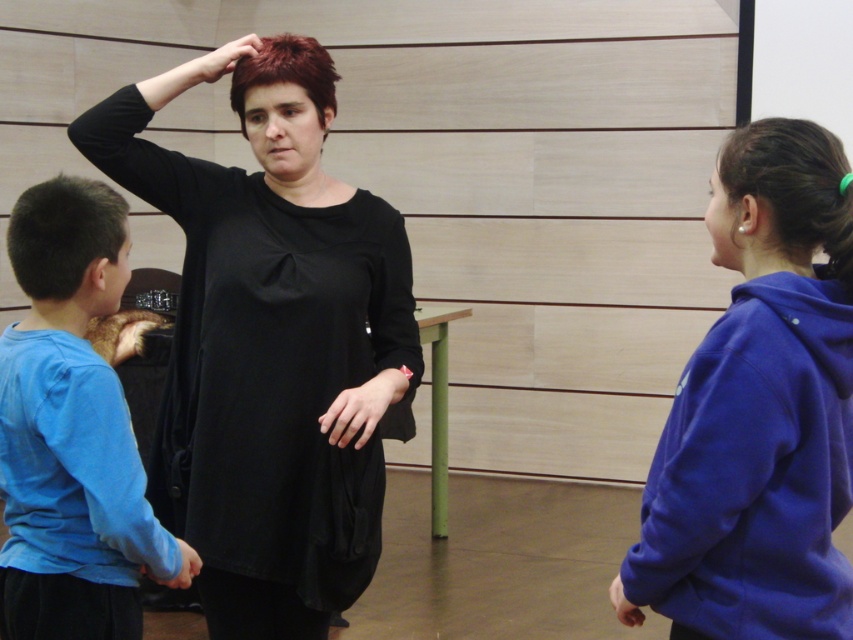
Question: Among these points, which one is farthest from the camera?

Choices:
 (A) (51, 266)
 (B) (227, 45)

Answer: (B)

Question: Which object is the closest to the blue cotton shirt at left?

Choices:
 (A) matte skin hand at lower center
 (B) shiny red hair at center
 (C) dark brown shiny hair at right
 (D) dark brown hair at left

Answer: (D)

Question: Is matte black hand at upper center closer to camera compared to matte skin hand at lower center?

Choices:
 (A) yes
 (B) no

Answer: (B)

Question: Which point is farther to the camera?

Choices:
 (A) (10, 218)
 (B) (849, 189)
 (C) (30, 214)

Answer: (A)

Question: Can you confirm if blue cotton shirt at left is positioned to the left of matte black hand at upper center?

Choices:
 (A) no
 (B) yes

Answer: (B)

Question: Is green rubber band at upper right smaller than blue fabric hand at lower left?

Choices:
 (A) yes
 (B) no

Answer: (A)